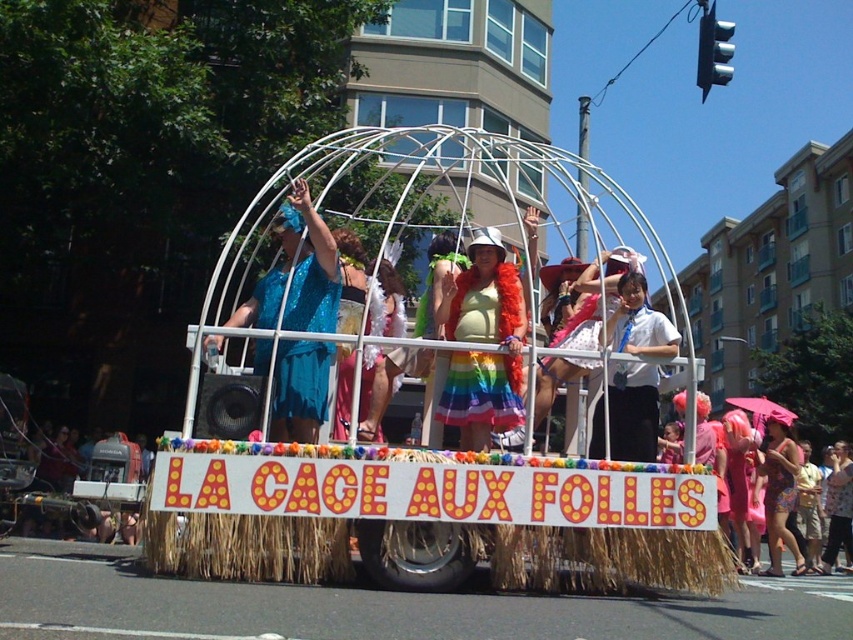
You are a photographer standing 20 feet away from the float. You want to take a picture that includes both the blue sequined dress at center and the floral print dress at center. Will both dresses fit in your camera frame if the camera has a 10 feet field of view?

The blue sequined dress at center and floral print dress at center are 19.80 feet apart from each other. Since the camera has a 10 feet field of view and the distance between the dresses is 19.80 feet, which is greater than 10 feet, the dresses will not both fit within the camera frame.

You are a photographer at the parade and want to capture both the blue sequined dress at center and the floral print dress at center in a single shot. Since you need to focus on the thinner one first, which dress should you adjust your camera to focus on?

The blue sequined dress at center is thinner than the floral print dress at center, so you should focus on the blue sequined dress at center first.

You are standing at the parade and want to take a photo of the float. The float is at point (325, 417). Your camera has a maximum focus range of 5 meters. Can you capture the float clearly?

The distance between you and the float at point (325, 417) is 6.08 meters, which exceeds your camera maximum focus range of 5 meters. You cannot capture the float clearly.